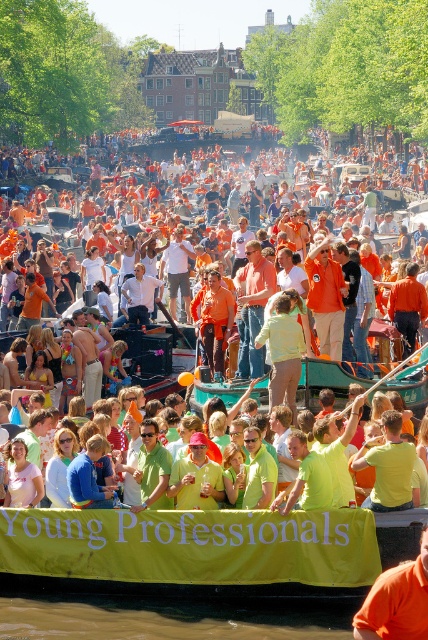
Question: Is orange fabric at center positioned before bright yellow shirt at center?

Choices:
 (A) yes
 (B) no

Answer: (A)

Question: Estimate the real-world distances between objects in this image. Which object is farther from the matte orange shirt at center?

Choices:
 (A) pastel green fabric at center
 (B) orange matte shirt at center
 (C) bright yellow shirt at center
 (D) orange fabric at center

Answer: (D)

Question: Which object appears closest to the camera in this image?

Choices:
 (A) orange fabric at center
 (B) orange matte shirt at center
 (C) pastel green fabric at center
 (D) matte orange shirt at center

Answer: (A)

Question: Does orange fabric at center appear on the right side of orange matte shirt at center?

Choices:
 (A) yes
 (B) no

Answer: (A)

Question: Is matte orange shirt at center further to the viewer compared to pastel green fabric at center?

Choices:
 (A) yes
 (B) no

Answer: (A)

Question: Among these points, which one is nearest to the camera?

Choices:
 (A) (356, 628)
 (B) (225, 332)
 (C) (335, 374)

Answer: (A)